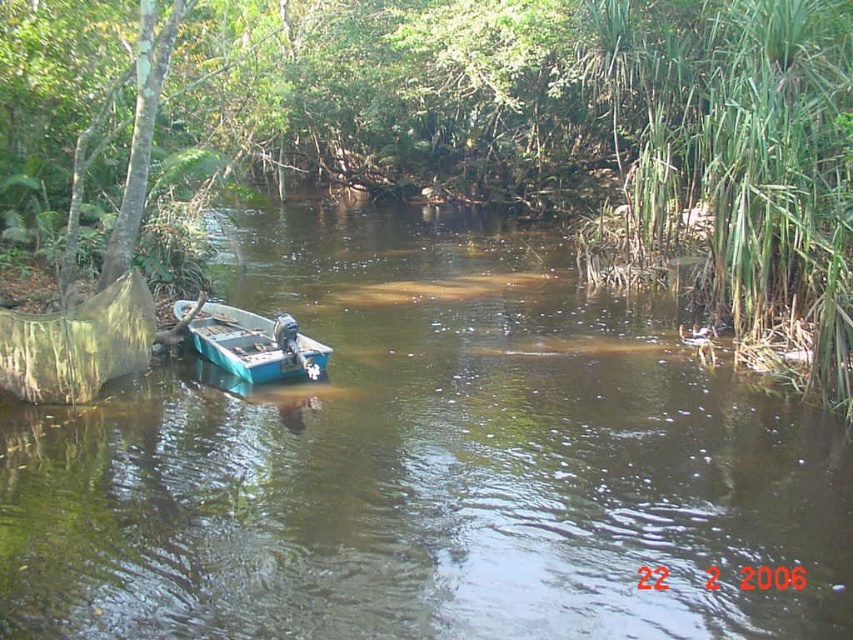
You are standing at the center of the image. Which direction should you look to see the green leafy tree at left?

The green leafy tree at left is located at point (608, 132), which is to the left side of the image. Therefore, you should look to your left to see it.

You are standing on the riverbank and want to reach the brown matte boat at center. If your maximum comfortable walking distance is 5 meters, can you comfortably walk to the boat?

The brown matte boat at center is 4.56 meters away from the viewer. Since your maximum comfortable walking distance is 5 meters, you can comfortably walk to the brown matte boat at center.